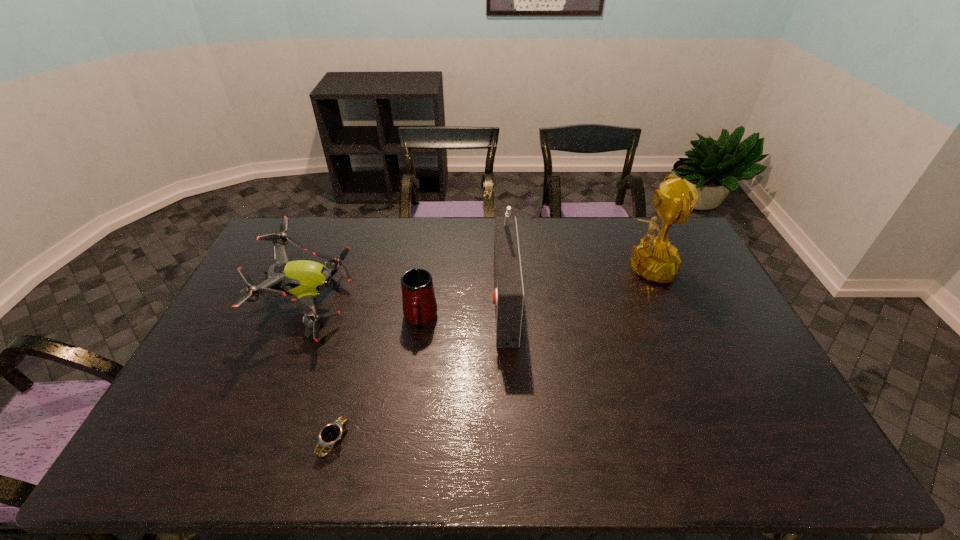
Find the location of a particular element. Image resolution: width=960 pixels, height=540 pixels. award is located at coordinates (655, 259).

You are a GUI agent. You are given a task and a screenshot of the screen. Output one action in this format:
    pyautogui.click(x=<x>, y=<y>)
    Task: Click on the radio receiver
    
    Given the screenshot: What is the action you would take?
    pyautogui.click(x=508, y=295)

I want to click on the third shortest object, so click(x=304, y=279).

This screenshot has width=960, height=540. In order to click on drone in this screenshot , I will do `click(304, 279)`.

Identify the location of mug. The image size is (960, 540). (419, 304).

Where is `the third object from right to left`? the third object from right to left is located at coordinates [419, 304].

This screenshot has width=960, height=540. I want to click on the nearest object, so click(x=331, y=433).

Locate an element on the screen. This screenshot has height=540, width=960. watch is located at coordinates (331, 433).

Identify the location of free location located 0.240m on the front side of the rightmost object. This screenshot has height=540, width=960. tap(543, 267).

This screenshot has width=960, height=540. Find the location of `vacant region located on the front side of the rightmost object`. vacant region located on the front side of the rightmost object is located at coordinates (580, 267).